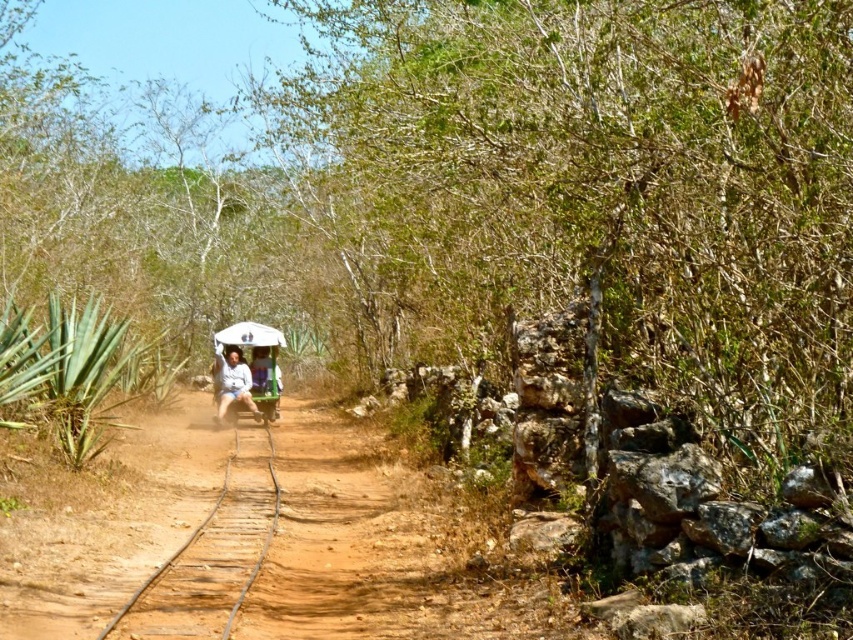
You are standing at the starting point of the dirt path in the image. You see two points marked on the path. The first point is at coordinate point (x=164, y=570) and the second is at point (x=239, y=388). If you were to walk along the path from the starting point, which point would you encounter first?

Point (x=164, y=570) is in front of point (x=239, y=388), so you would encounter point (x=164, y=570) first when walking along the path from the starting point.

You are a delivery person carrying a package that is 2 meters long. You need to move it through the space between the brown wooden train track at center and the light blue fabric umbrella at center. Is there enough space for the package to pass through?

The brown wooden train track at center and light blue fabric umbrella at center are 2.12 meters apart from each other. Since the package is 2 meters long, there is enough space for it to pass through as the distance between them is greater than the package length.

You are a traveler standing on the narrow dirt path between the light blue fabric umbrella at center and the white matte umbrella at center. You need to pass through this space to continue your journey. Can you safely walk through the path between them without touching either umbrella?

The distance between the light blue fabric umbrella at center and the white matte umbrella at center is 1.33 meters. Since the average width of a person is about 0.5 meters, there is sufficient space for you to walk through safely without touching either umbrella.